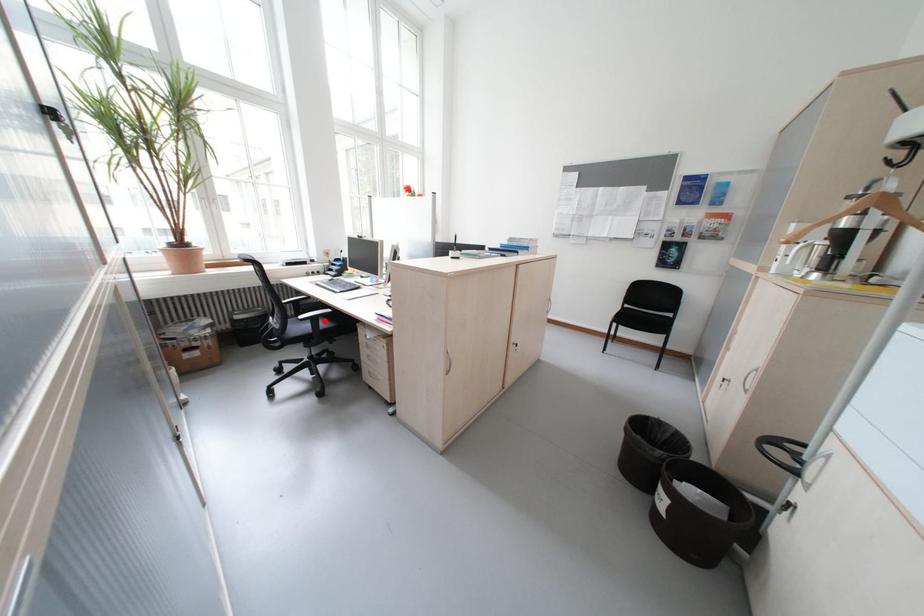
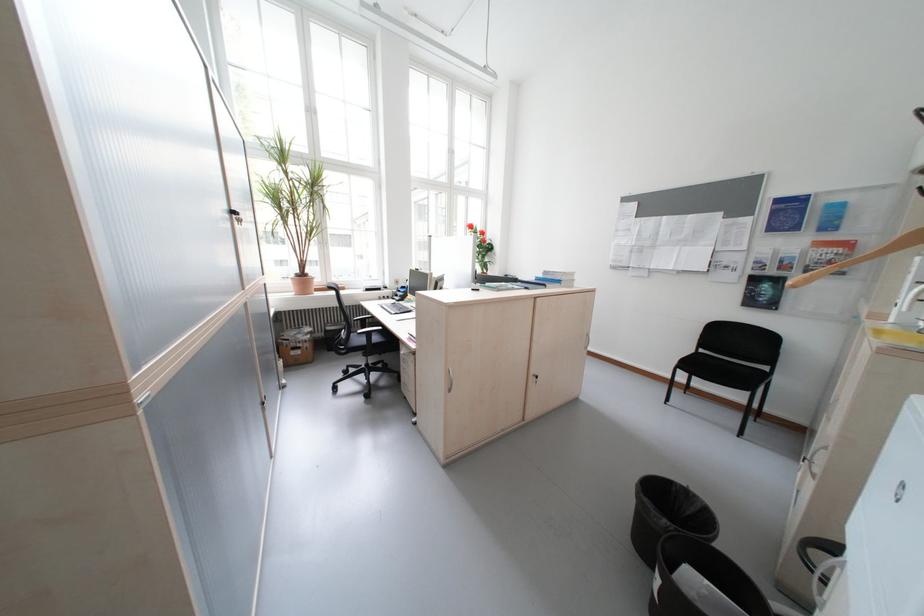
Where in the second image is the point corresponding to the highlighted location from the first image?

(380, 334)